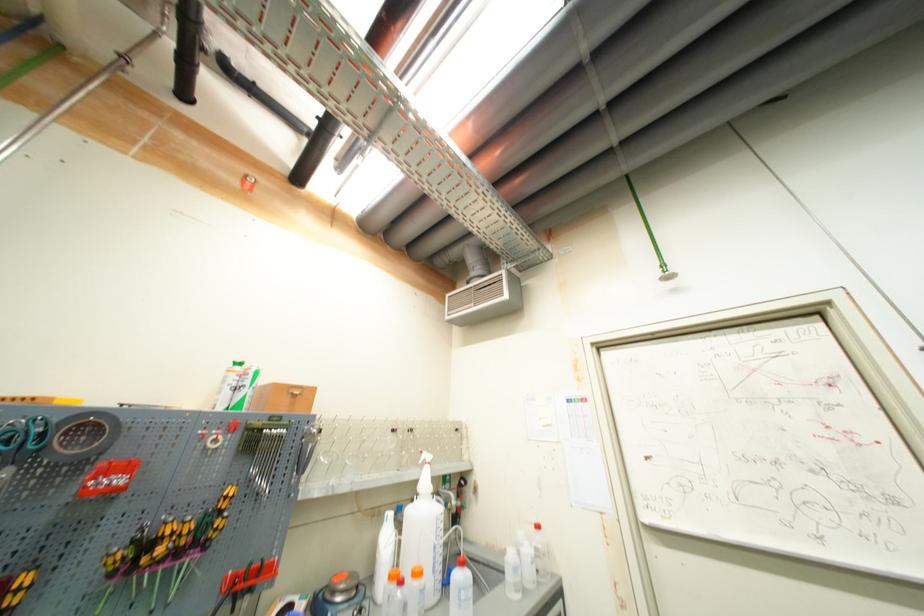
The image size is (924, 616). Identify the location of blue bottle cap. (548, 585).